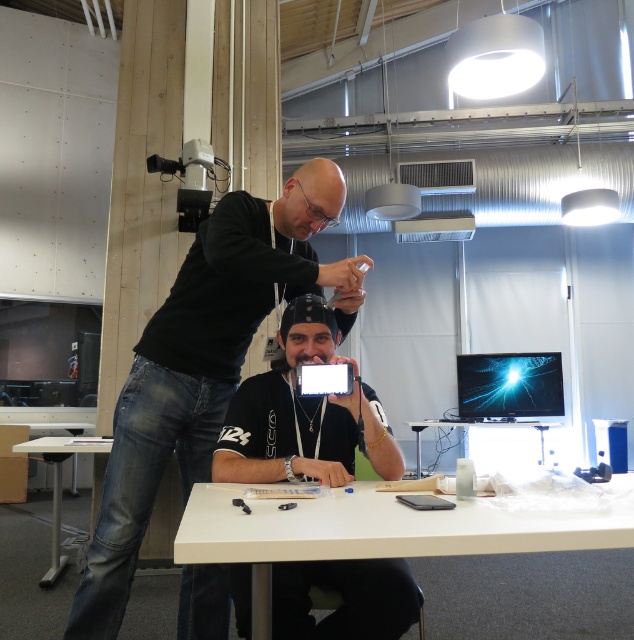
You are navigating through the workspace and need to reach a specific point. Which of the two points, point 1 at coordinates point (401,518) or point 2 at coordinates point (56,493), is closer to you?

Point 1 at coordinates point (401,518) is closer to you than point 2 at coordinates point (56,493).

You are a technician in the lab and need to locate the black matte phone at center. According to the coordinates provided, where would you find it?

The black matte phone at center is located at point coordinates of 0.572 on the x axis and 0.320 on the y axis.

You are standing in the workspace and need to locate two points marked in the image. The first point is at coordinates point (119, 429) and the second is at point (42, 438). From your perspective, which point is closer to you?

Point (42, 438) is closer to you because it is behind point (119, 429), making it nearer to your position.